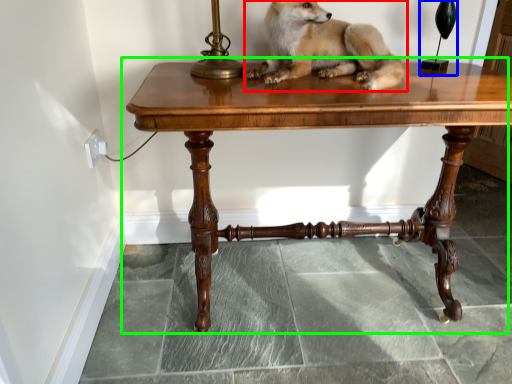
Question: Estimate the real-world distances between objects in this image. Which object is farther from dog (highlighted by a red box), table lamp (highlighted by a blue box) or table (highlighted by a green box)?

Choices:
 (A) table lamp
 (B) table

Answer: (A)